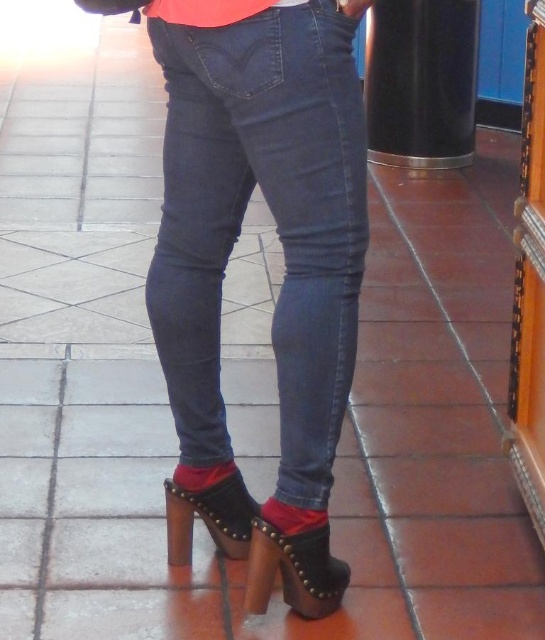
Question: Which point is closer to the camera?

Choices:
 (A) black glossy pillar at upper right
 (B) studded leather sandal at lower center
 (C) leather studded sandal at lower center

Answer: (B)

Question: Which of the following is the closest to the observer?

Choices:
 (A) denim jeans at center
 (B) black glossy pillar at upper right
 (C) studded leather sandal at lower center

Answer: (A)

Question: Does black glossy pillar at upper right have a greater width compared to leather studded sandal at lower center?

Choices:
 (A) yes
 (B) no

Answer: (A)

Question: Is denim jeans at center further to the viewer compared to leather studded sandal at lower center?

Choices:
 (A) yes
 (B) no

Answer: (B)

Question: Which point is closer to the camera?

Choices:
 (A) leather studded sandal at lower center
 (B) black glossy pillar at upper right

Answer: (A)

Question: Does denim jeans at center have a greater width compared to black glossy pillar at upper right?

Choices:
 (A) no
 (B) yes

Answer: (A)